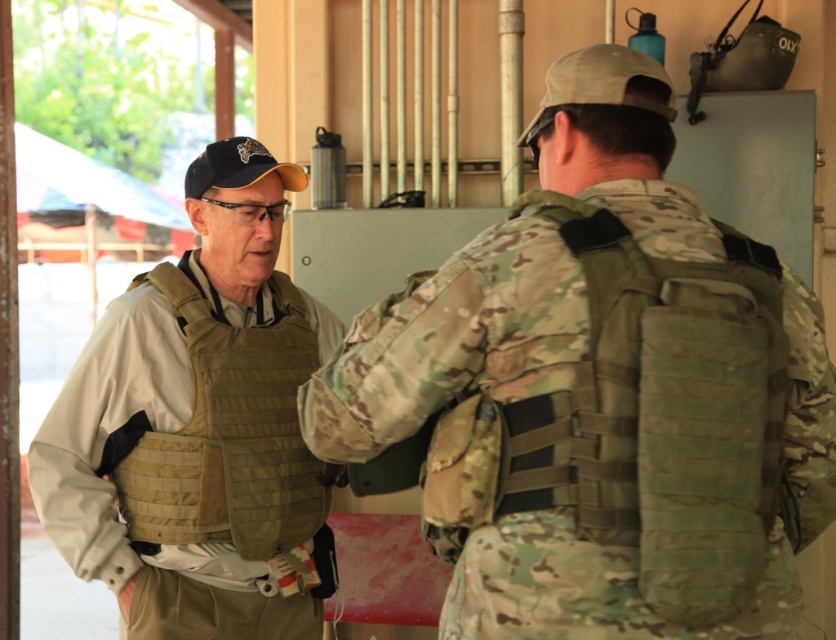
Is point (789, 298) behind point (655, 307)?

Yes, it is behind point (655, 307).

Can you confirm if camouflage fabric vest at center is positioned below camouflage fabric vest at back?

No, camouflage fabric vest at center is not below camouflage fabric vest at back.

Describe the element at coordinates (600, 392) in the screenshot. This screenshot has height=640, width=836. I see `camouflage fabric vest at center` at that location.

Locate an element on the screen. camouflage fabric vest at center is located at coordinates (600, 392).

Does point (687, 483) lie in front of point (274, 410)?

Yes, point (687, 483) is in front of point (274, 410).

Is point (811, 531) positioned behind point (243, 358)?

No, it is not.

Which is in front, point (502, 540) or point (264, 532)?

Point (502, 540) is in front.

What are the coordinates of `camouflage fabric vest at center` in the screenshot? It's located at coord(600,392).

Between tan fabric vest at left and camouflage fabric vest at back, which one has more height?

tan fabric vest at left is taller.

Can you confirm if tan fabric vest at left is shorter than camouflage fabric vest at back?

No.

The height and width of the screenshot is (640, 836). Describe the element at coordinates (199, 428) in the screenshot. I see `tan fabric vest at left` at that location.

The height and width of the screenshot is (640, 836). In order to click on tan fabric vest at left in this screenshot , I will do `click(199, 428)`.